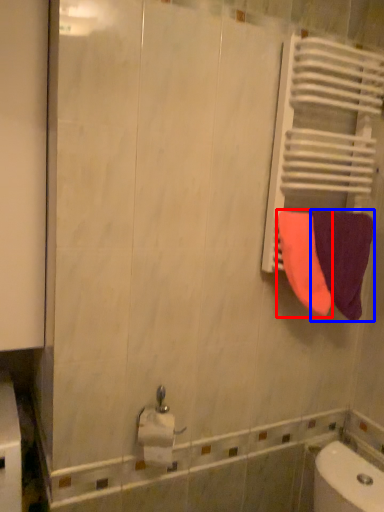
Question: Among these objects, which one is nearest to the camera, towel (highlighted by a red box) or towel (highlighted by a blue box)?

Choices:
 (A) towel
 (B) towel

Answer: (A)